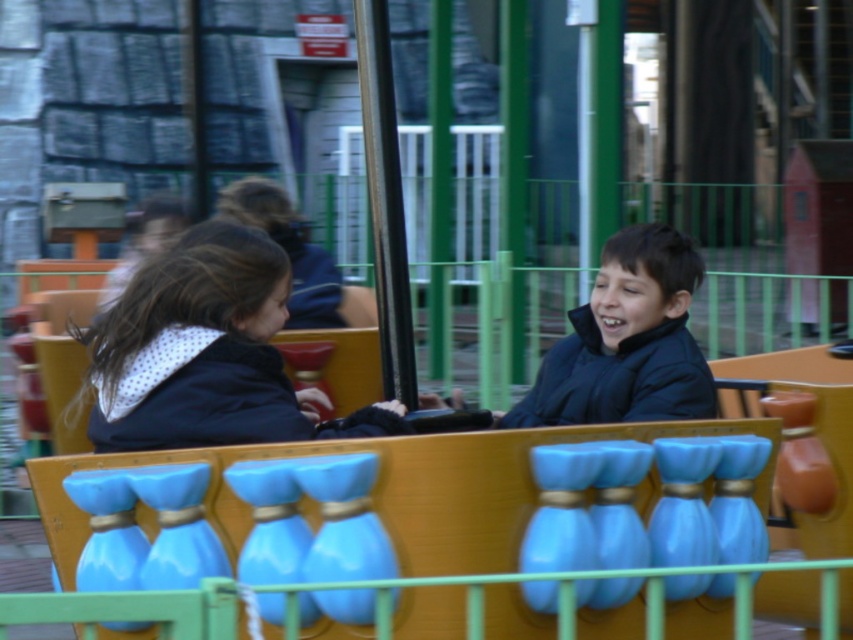
Question: Is the position of matte black jacket at left less distant than that of black matte jacket at center?

Choices:
 (A) yes
 (B) no

Answer: (A)

Question: Considering the relative positions of matte black jacket at left and black matte jacket at center in the image provided, where is matte black jacket at left located with respect to black matte jacket at center?

Choices:
 (A) above
 (B) below

Answer: (B)

Question: Which object is closer to the camera taking this photo?

Choices:
 (A) black matte jacket at center
 (B) matte black jacket at left

Answer: (B)

Question: Which object is farther from the camera taking this photo?

Choices:
 (A) black matte jacket at center
 (B) matte black jacket at left

Answer: (A)

Question: Which point is farther from the camera taking this photo?

Choices:
 (A) (601, 362)
 (B) (171, 253)

Answer: (A)

Question: Is matte black jacket at left to the right of black matte jacket at center from the viewer's perspective?

Choices:
 (A) yes
 (B) no

Answer: (B)